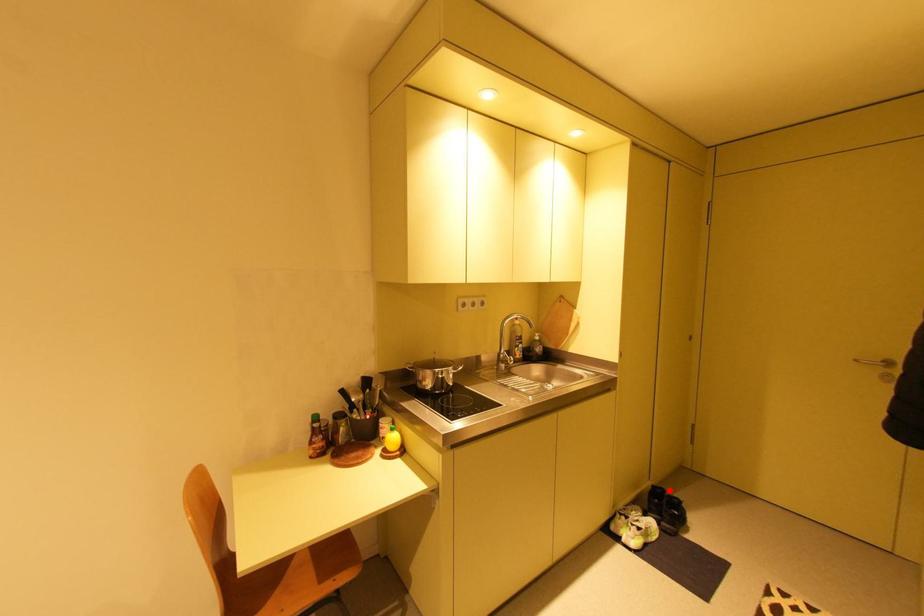
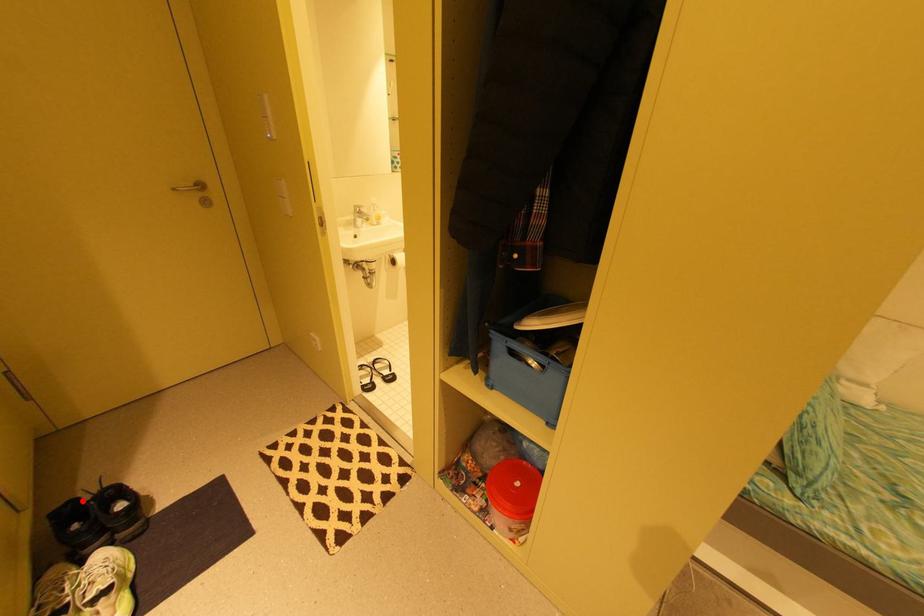
I am providing you with two images of the same scene from different viewpoints. A red point is marked on the first image and another point is marked on the second image. Is the red point in image1 aligned with the point shown in image2?

Yes